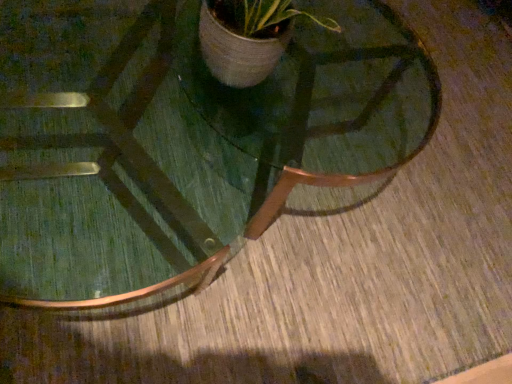
At what (x,y) coordinates should I click in order to perform the action: click on green wood table at center. Please return your answer as a coordinate pair (x, y). Looking at the image, I should click on (324, 93).

Describe the element at coordinates (324, 93) in the screenshot. I see `green wood table at center` at that location.

What do you see at coordinates (182, 140) in the screenshot? I see `green glass coffee table at center` at bounding box center [182, 140].

What is the approximate width of green glass coffee table at center?

green glass coffee table at center is 36.56 inches in width.

You are a GUI agent. You are given a task and a screenshot of the screen. Output one action in this format:
    pyautogui.click(x=<x>, y=<y>)
    Task: Click on the green glass coffee table at center
    
    Given the screenshot: What is the action you would take?
    pyautogui.click(x=182, y=140)

Find the location of a particular element. The width and height of the screenshot is (512, 384). green wood table at center is located at coordinates (324, 93).

Is green glass coffee table at center at the right side of green wood table at center?

No.

Is green glass coffee table at center positioned behind green wood table at center?

That is True.

Is point (346, 87) closer or farther from the camera than point (309, 90)?

Point (346, 87) appears to be farther away from the viewer than point (309, 90).

From the image's perspective, does green glass coffee table at center appear higher than green wood table at center?

No, from the image's perspective, green glass coffee table at center is not above green wood table at center.

From a real-world perspective, is green glass coffee table at center physically located above or below green wood table at center?

Clearly, from a real-world perspective, green glass coffee table at center is below green wood table at center.

Does green glass coffee table at center have a lesser width compared to green wood table at center?

No.

Considering the sizes of green glass coffee table at center and green wood table at center in the image, is green glass coffee table at center taller or shorter than green wood table at center?

In the image, green glass coffee table at center appears to be taller than green wood table at center.

Considering the relative sizes of green glass coffee table at center and green wood table at center in the image provided, is green glass coffee table at center smaller than green wood table at center?

No.

From the picture: Is green wood table at center completely or partially inside green glass coffee table at center?

No, green wood table at center is not a part of green glass coffee table at center.

Are green glass coffee table at center and green wood table at center located far from each other?

No, green glass coffee table at center is not far from green wood table at center.

Is green wood table at center at the back of green glass coffee table at center?

green glass coffee table at center does not have its back to green wood table at center.

How many degrees apart are the facing directions of green glass coffee table at center and green wood table at center?

The angle between the facing direction of green glass coffee table at center and the facing direction of green wood table at center is 0.000723 degrees.

This screenshot has width=512, height=384. I want to click on coffee table on the left of green wood table at center, so click(x=182, y=140).

Does green wood table at center appear on the left side of green glass coffee table at center?

No.

In the image, is green wood table at center positioned in front of or behind green glass coffee table at center?

green wood table at center is positioned closer to the viewer than green glass coffee table at center.

Between point (327, 178) and point (409, 91), which one is positioned behind?

The point (409, 91) is farther from the camera.

Looking at this image, from the image's perspective, is green wood table at center on green glass coffee table at center?

Indeed, from the image's perspective, green wood table at center is shown above green glass coffee table at center.

From a real-world perspective, is green wood table at center on top of green glass coffee table at center?

Yes, from a real-world perspective, green wood table at center is above green glass coffee table at center.

Does green wood table at center have a lesser width compared to green glass coffee table at center?

Yes, green wood table at center is thinner than green glass coffee table at center.

Who is taller, green wood table at center or green glass coffee table at center?

green glass coffee table at center is taller.

Between green wood table at center and green glass coffee table at center, which one has larger size?

green glass coffee table at center.

Do you think green wood table at center is within green glass coffee table at center, or outside of it?

The correct answer is: outside.

Is green wood table at center placed right next to green glass coffee table at center?

No, green wood table at center is not making contact with green glass coffee table at center.

Could you tell me if green wood table at center is facing green glass coffee table at center?

No, green wood table at center is not turned towards green glass coffee table at center.

What's the angular difference between green wood table at center and green glass coffee table at center's facing directions?

0.000723 degrees separate the facing orientations of green wood table at center and green glass coffee table at center.

This screenshot has width=512, height=384. Find the location of `round table above the green glass coffee table at center (from a real-world perspective)`. round table above the green glass coffee table at center (from a real-world perspective) is located at coordinates (324, 93).

This screenshot has width=512, height=384. Identify the location of round table located on the right of green glass coffee table at center. (324, 93).

In the image, there is a green wood table at center. At what (x,y) coordinates should I click in order to perform the action: click on coffee table below it (from a real-world perspective). Please return your answer as a coordinate pair (x, y). The height and width of the screenshot is (384, 512). Looking at the image, I should click on (182, 140).